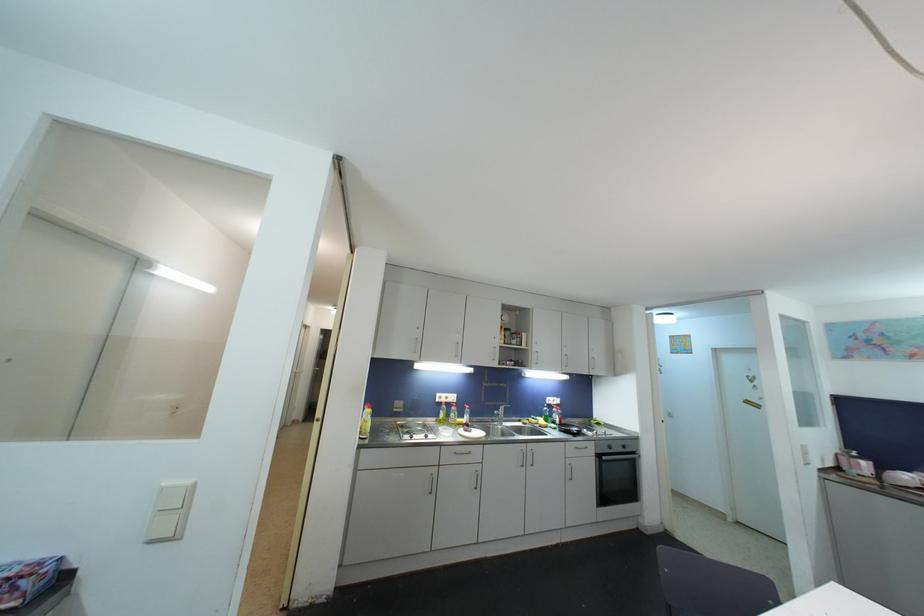
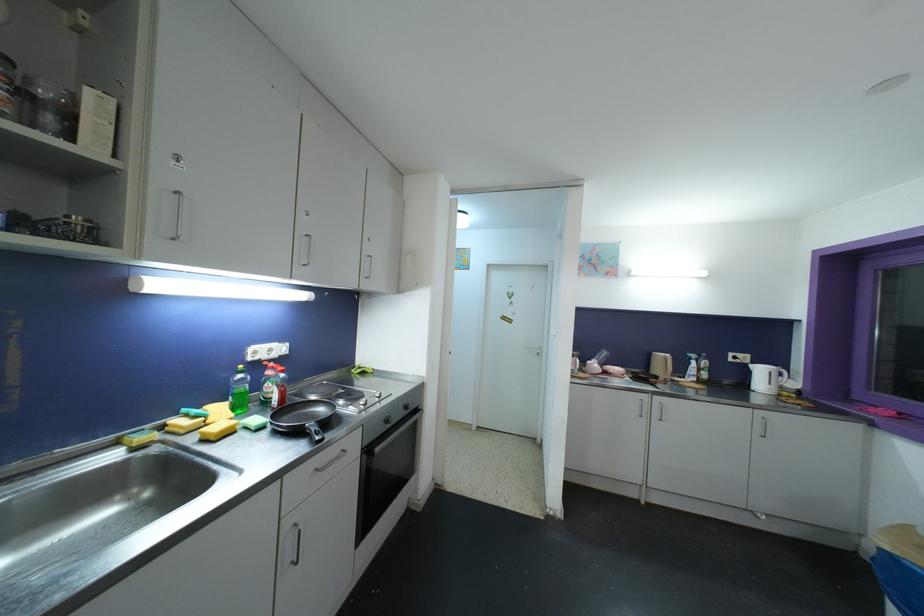
In the second image, find the point that corresponds to point 613,450 in the first image.

(390, 424)